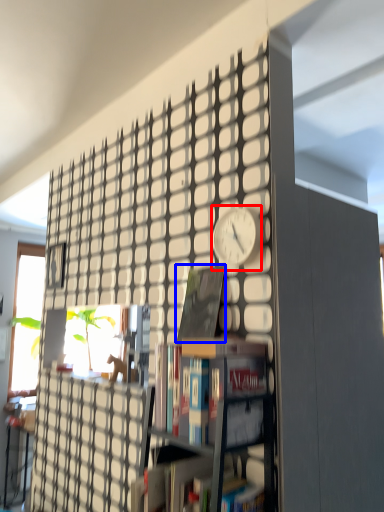
Question: Which point is further to the camera, clock (highlighted by a red box) or book (highlighted by a blue box)?

Choices:
 (A) clock
 (B) book

Answer: (B)